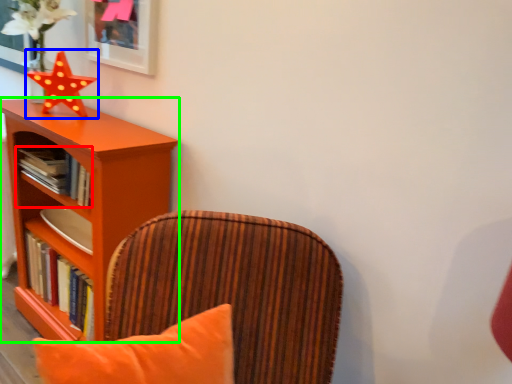
Question: Estimate the real-world distances between objects in this image. Which object is farther from book (highlighted by a red box), star (highlighted by a blue box) or shelf (highlighted by a green box)?

Choices:
 (A) star
 (B) shelf

Answer: (A)